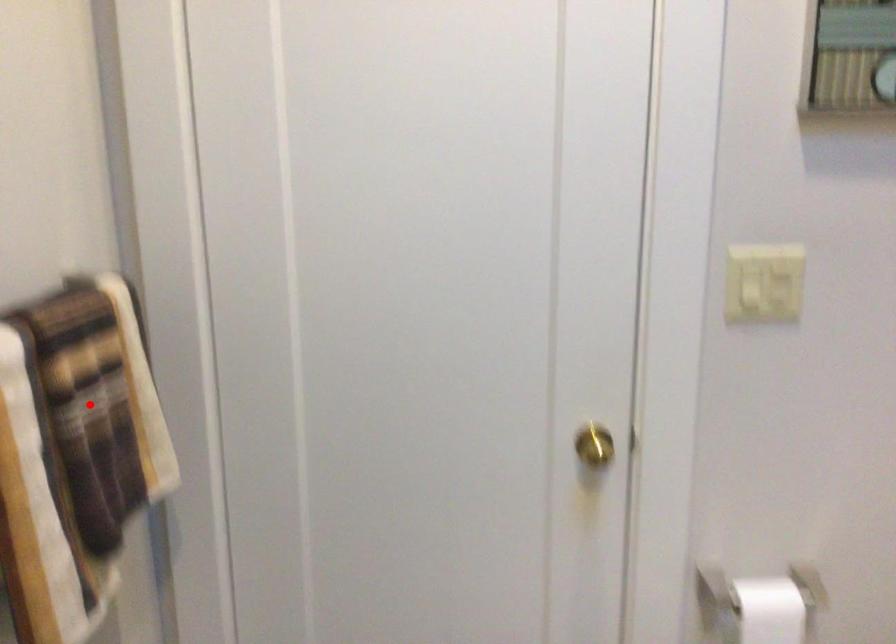
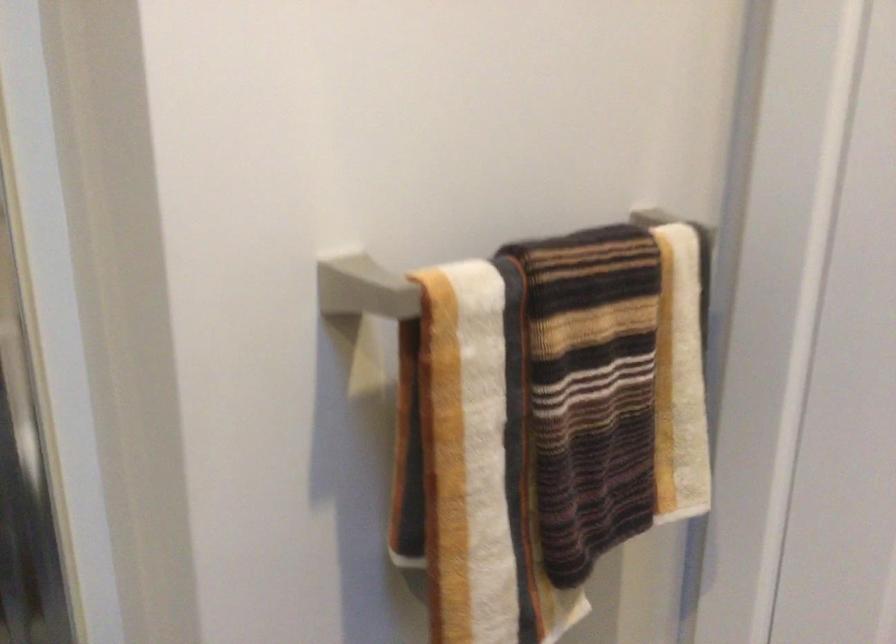
Question: I am providing you with two images of the same scene from different viewpoints. Given a red point in image1, look at the same physical point in image2. Is it:

Choices:
 (A) Closer to the viewpoint
 (B) Farther from the viewpoint

Answer: (A)